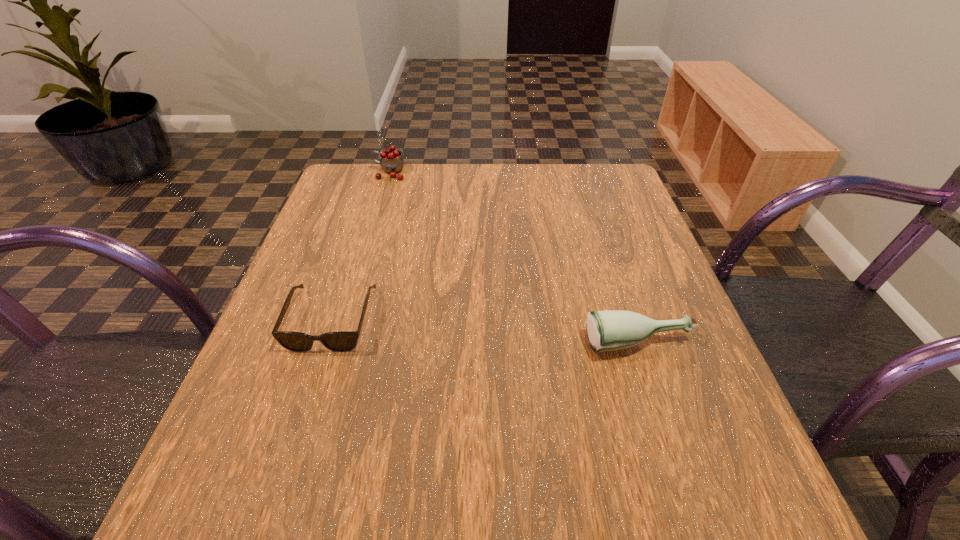
Locate an element on the screen. This screenshot has width=960, height=540. vacant area at the far right corner of the desktop is located at coordinates (596, 198).

The height and width of the screenshot is (540, 960). Find the location of `vacant space at the near right corner`. vacant space at the near right corner is located at coordinates (673, 510).

Locate an element on the screen. free spot between the cherry and the rightmost object is located at coordinates (514, 258).

The width and height of the screenshot is (960, 540). What are the coordinates of `vacant space that is in between the farthest object and the bottle` in the screenshot? It's located at (514, 258).

You are a GUI agent. You are given a task and a screenshot of the screen. Output one action in this format:
    pyautogui.click(x=<x>, y=<y>)
    Task: Click on the unoccupied position between the sunglasses and the cherry
    
    Given the screenshot: What is the action you would take?
    pyautogui.click(x=360, y=246)

Identify the location of vacant area between the sunglasses and the rightmost object. (485, 332).

I want to click on vacant point located between the farthest object and the shortest object, so click(x=360, y=246).

Locate an element on the screen. vacant space that is in between the tallest object and the second shortest object is located at coordinates (514, 258).

Locate an element on the screen. The width and height of the screenshot is (960, 540). free area in between the shortest object and the second shortest object is located at coordinates (485, 332).

The height and width of the screenshot is (540, 960). I want to click on empty location between the farthest object and the second shortest object, so click(514, 258).